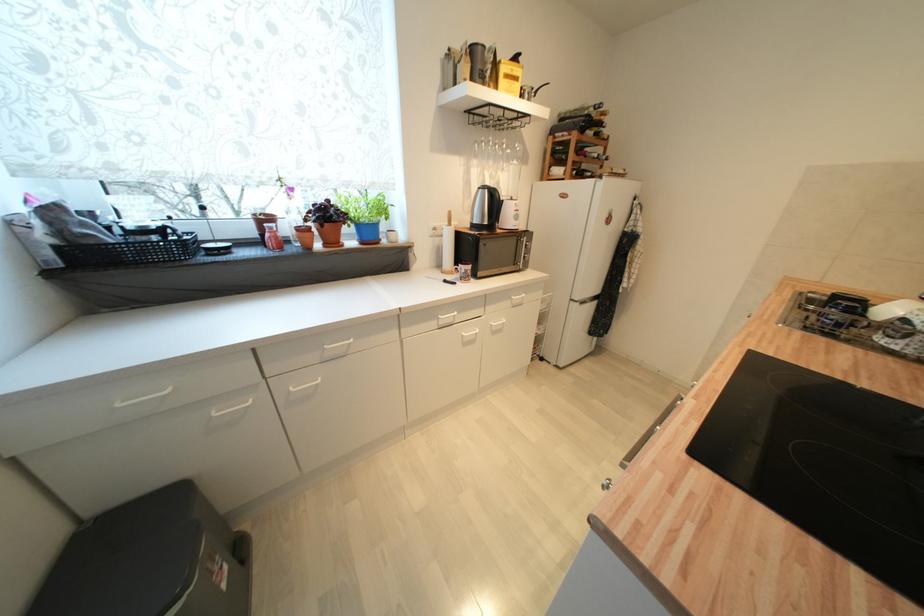
Locate an element on the screen. Image resolution: width=924 pixels, height=616 pixels. ceramic mug is located at coordinates (508, 215).